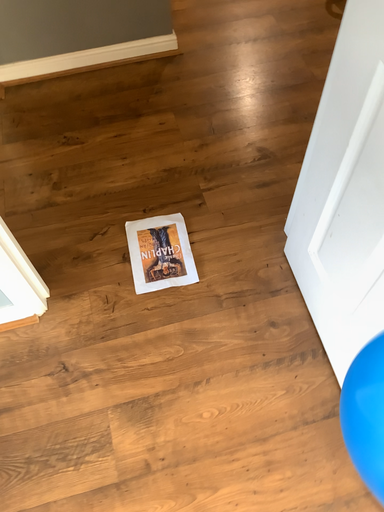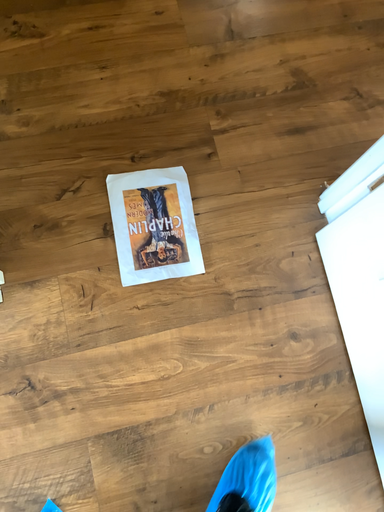
Question: Which way did the camera rotate in the video?

Choices:
 (A) rotated upward
 (B) rotated downward

Answer: (B)